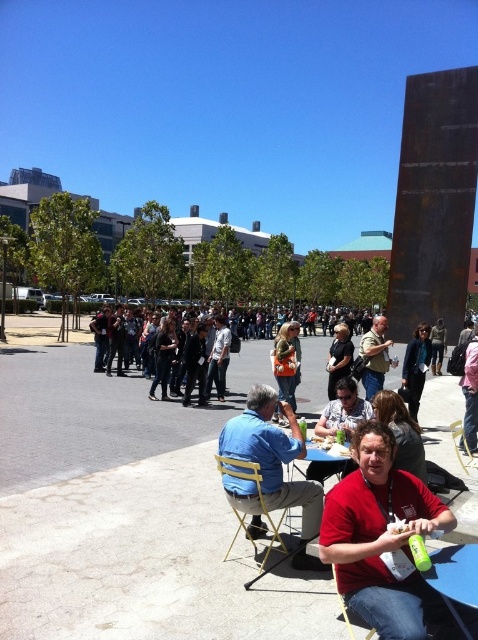
You are a photographer trying to capture a photo of the orange fabric purse at center without including the red matte shirt at lower right in the frame. Is this possible given their positions?

The red matte shirt at lower right is located above the orange fabric purse at center, so if you position the camera to focus on the orange fabric purse at center while angling it downward, you can avoid including the red matte shirt at lower right in the photo.

You are standing in the outdoor scene and want to take a photo of both point (387, 616) and point (419, 362). Which point should you focus on first to ensure both are in the frame?

You should focus on point (387, 616) first because it is closer to the camera than point (419, 362), ensuring both points are within the frame.

You are standing in the outdoor scene and want to take a photo of both point (360, 492) and point (299, 348) in the image. Since you want both points to be in focus, which point should you focus on to ensure the other is also sharp?

You should focus on point (299, 348) because it is farther from the camera than point (360, 492). By focusing on the farther point, the closer point will also be within the depth of field, ensuring both are sharp.